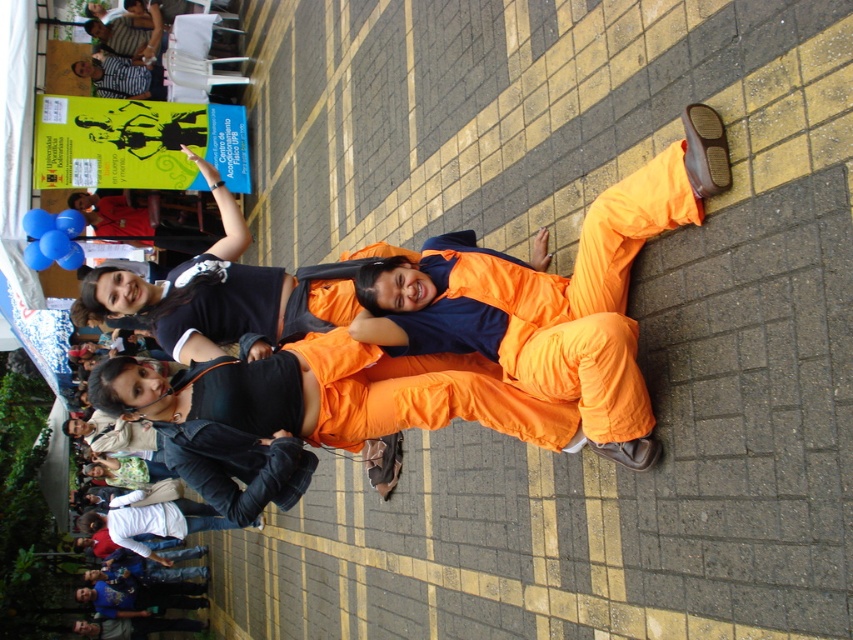
Question: Can you confirm if orange fabric jumpsuit at center is smaller than orange fabric pants at center?

Choices:
 (A) yes
 (B) no

Answer: (B)

Question: Is orange fabric jumpsuit at center below orange fabric pants at center?

Choices:
 (A) no
 (B) yes

Answer: (B)

Question: Which object appears farthest from the camera in this image?

Choices:
 (A) orange fabric jumpsuit at center
 (B) orange fabric pants at center

Answer: (B)

Question: Which of the following is the closest to the observer?

Choices:
 (A) orange fabric jumpsuit at center
 (B) orange fabric pants at center

Answer: (A)

Question: Does orange fabric jumpsuit at center lie behind orange fabric pants at center?

Choices:
 (A) no
 (B) yes

Answer: (A)